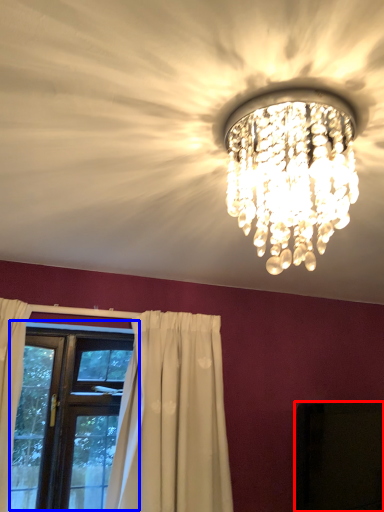
Question: Which object appears farthest to the camera in this image, dark (highlighted by a red box) or window (highlighted by a blue box)?

Choices:
 (A) dark
 (B) window

Answer: (B)